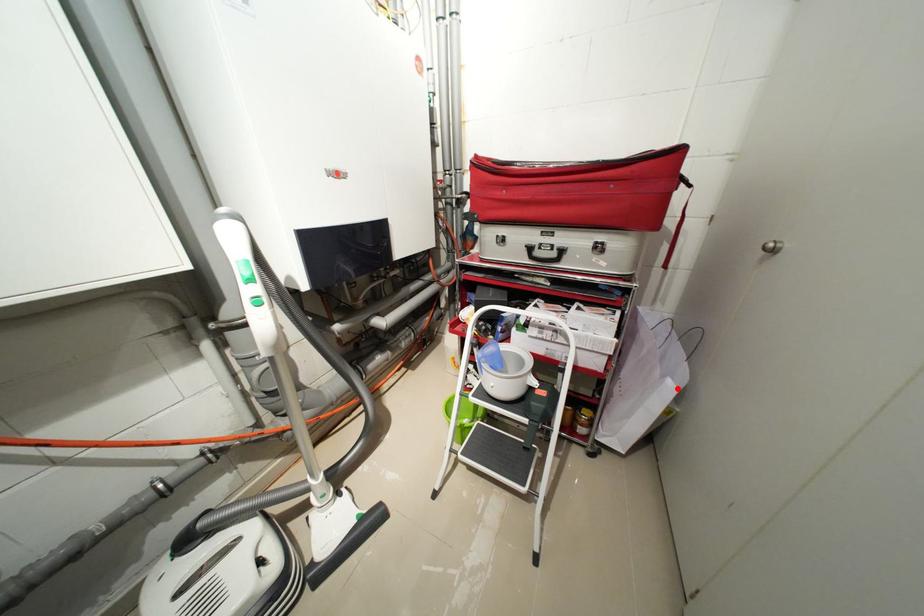
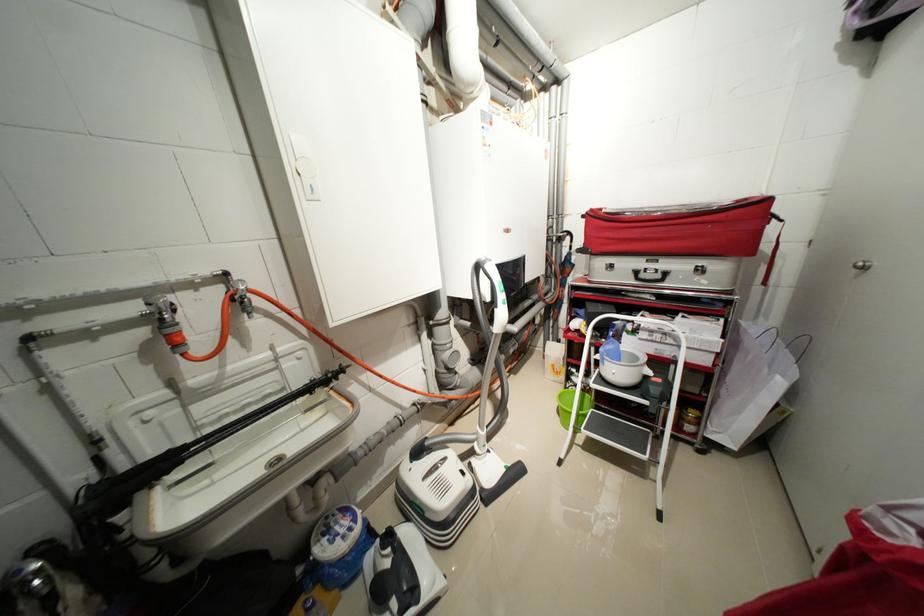
The point at the highlighted location is marked in the first image. Where is the corresponding point in the second image?

(787, 384)